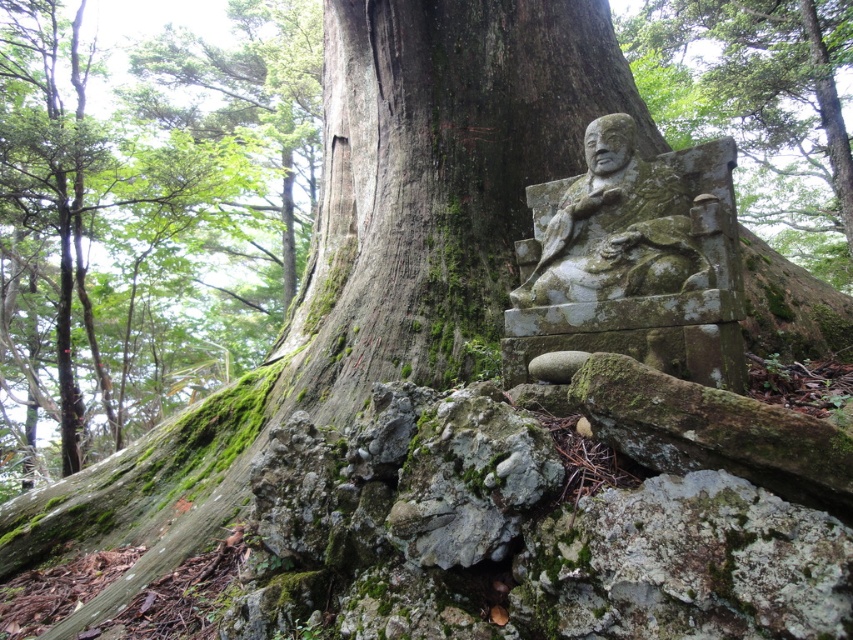
Does green mossy stone statue at center have a lesser width compared to green mossy stone statue at lower right?

Indeed, green mossy stone statue at center has a lesser width compared to green mossy stone statue at lower right.

From the picture: Who is shorter, green mossy stone statue at center or green mossy stone statue at lower right?

Standing shorter between the two is green mossy stone statue at center.

In order to click on green mossy stone statue at center in this screenshot , I will do `click(633, 260)`.

Is point (56, 49) farther from camera compared to point (587, 326)?

Yes, it is behind point (587, 326).

Which of these two, green mossy bark at lower left or green mossy stone statue at center, stands shorter?

green mossy stone statue at center is shorter.

Where is `green mossy bark at lower left`? green mossy bark at lower left is located at coordinates (144, 220).

Is point (151, 221) closer to camera compared to point (845, 44)?

That is True.

Locate an element on the screen. green mossy bark at lower left is located at coordinates (144, 220).

In order to click on green mossy bark at lower left in this screenshot , I will do `click(144, 220)`.

Where is `green mossy bark at lower left`? Image resolution: width=853 pixels, height=640 pixels. green mossy bark at lower left is located at coordinates (144, 220).